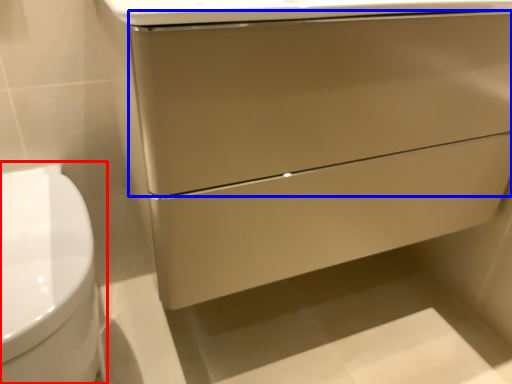
Question: Which point is closer to the camera, toilet (highlighted by a red box) or drawer (highlighted by a blue box)?

Choices:
 (A) toilet
 (B) drawer

Answer: (A)